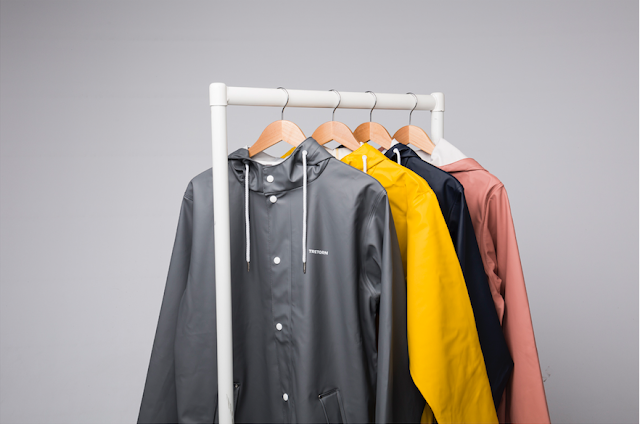
At what (x,y) coordinates should I click in order to perform the action: click on hangers. Please return your answer as a coordinate pair (x, y). Looking at the image, I should click on pos(282,132), pos(335,132), pos(388,131), pos(410,138).